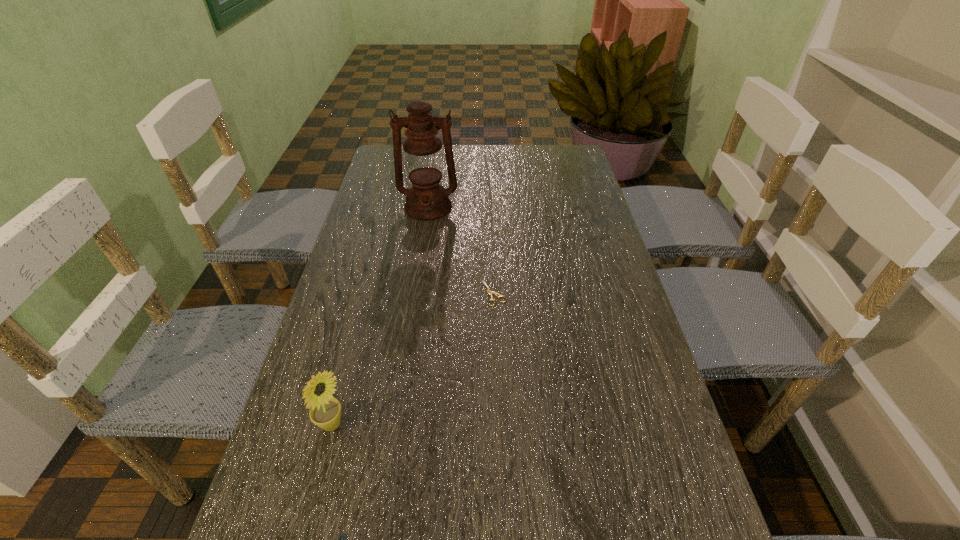
Find the location of a particular element. object that is the third closest to the left shears is located at coordinates (426, 200).

Image resolution: width=960 pixels, height=540 pixels. I want to click on vacant area in the image that satisfies the following two spatial constraints: 1. on the front side of the oil lamp; 2. on the face of the third shortest object, so click(396, 424).

The width and height of the screenshot is (960, 540). Find the location of `free space in the image that satisfies the following two spatial constraints: 1. on the front side of the rightmost object; 2. on the right side of the farthest object`. free space in the image that satisfies the following two spatial constraints: 1. on the front side of the rightmost object; 2. on the right side of the farthest object is located at coordinates (416, 293).